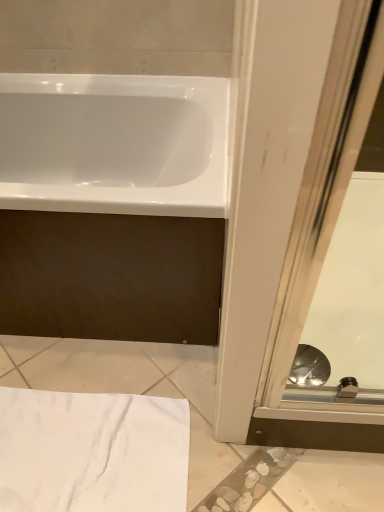
I want to click on white cotton towel at lower left, so click(92, 452).

The image size is (384, 512). Identify the location of white glossy bathtub at upper left. (114, 144).

Identify the location of white cotton towel at lower left. (92, 452).

Which is behind, point (129, 196) or point (76, 480)?

The point (76, 480) is farther from the camera.

Does white glossy bathtub at upper left have a greater height compared to white cotton towel at lower left?

Indeed, white glossy bathtub at upper left has a greater height compared to white cotton towel at lower left.

Between white glossy bathtub at upper left and white cotton towel at lower left, which one appears on the right side from the viewer's perspective?

From the viewer's perspective, white cotton towel at lower left appears more on the right side.

Is white glossy bathtub at upper left turned away from white cotton towel at lower left?

white glossy bathtub at upper left is not turned away from white cotton towel at lower left.

How different are the orientations of white cotton towel at lower left and transparent glass screen door at lower right in degrees?

The angular difference between white cotton towel at lower left and transparent glass screen door at lower right is 0.00106 degrees.

Based on the photo, is white cotton towel at lower left not near transparent glass screen door at lower right?

white cotton towel at lower left is near transparent glass screen door at lower right, not far away.

From the image's perspective, would you say white cotton towel at lower left is positioned over transparent glass screen door at lower right?

Incorrect, from the image's perspective, white cotton towel at lower left is lower than transparent glass screen door at lower right.

Which of these two, transparent glass screen door at lower right or white cotton towel at lower left, is thinner?

white cotton towel at lower left.

Find the location of `bath towel that is under the transparent glass screen door at lower right (from a real-world perspective)`. bath towel that is under the transparent glass screen door at lower right (from a real-world perspective) is located at coordinates (92, 452).

Is transparent glass screen door at lower right facing towards white cotton towel at lower left?

No, transparent glass screen door at lower right is not facing towards white cotton towel at lower left.

Is transparent glass screen door at lower right closer to camera compared to white cotton towel at lower left?

Yes, transparent glass screen door at lower right is closer to the camera.

Does white glossy bathtub at upper left appear on the right side of transparent glass screen door at lower right?

Incorrect, white glossy bathtub at upper left is not on the right side of transparent glass screen door at lower right.

Is point (86, 142) closer or farther from the camera than point (327, 387)?

Point (86, 142) is farther from the camera than point (327, 387).

From the image's perspective, is white glossy bathtub at upper left located beneath transparent glass screen door at lower right?

Actually, white glossy bathtub at upper left appears above transparent glass screen door at lower right in the image.

Is white glossy bathtub at upper left directly adjacent to transparent glass screen door at lower right?

No, white glossy bathtub at upper left is not beside transparent glass screen door at lower right.

From a real-world perspective, which object stands above the other?

white glossy bathtub at upper left is physically above.

Does transparent glass screen door at lower right appear on the right side of white glossy bathtub at upper left?

Correct, you'll find transparent glass screen door at lower right to the right of white glossy bathtub at upper left.

Relative to white glossy bathtub at upper left, is transparent glass screen door at lower right in front or behind?

Clearly, transparent glass screen door at lower right is behind white glossy bathtub at upper left.

Can you tell me how much transparent glass screen door at lower right and white glossy bathtub at upper left differ in facing direction?

There is a 0.000206-degree angle between the facing directions of transparent glass screen door at lower right and white glossy bathtub at upper left.

In the scene shown: Is white cotton towel at lower left to the right of white glossy bathtub at upper left from the viewer's perspective?

Yes, white cotton towel at lower left is to the right of white glossy bathtub at upper left.

Which object is thinner, white cotton towel at lower left or white glossy bathtub at upper left?

white cotton towel at lower left.

From a real-world perspective, which object stands above the other?

From a 3D spatial view, white glossy bathtub at upper left is above.

Between white cotton towel at lower left and white glossy bathtub at upper left, which one has more height?

white glossy bathtub at upper left is taller.

At what (x,y) coordinates should I click in order to perform the action: click on bathtub in front of the white cotton towel at lower left. Please return your answer as a coordinate pair (x, y). Looking at the image, I should click on (114, 144).

Identify the location of bath towel behind the transparent glass screen door at lower right. (92, 452).

Considering their positions, is white glossy bathtub at upper left positioned closer to white cotton towel at lower left than transparent glass screen door at lower right?

Among the two, transparent glass screen door at lower right is located nearer to white cotton towel at lower left.

Estimate the real-world distances between objects in this image. Which object is closer to white glossy bathtub at upper left, white cotton towel at lower left or transparent glass screen door at lower right?

Among the two, transparent glass screen door at lower right is located nearer to white glossy bathtub at upper left.

From the image, which object appears to be nearer to white cotton towel at lower left, transparent glass screen door at lower right or white glossy bathtub at upper left?

transparent glass screen door at lower right lies closer to white cotton towel at lower left than the other object.

Estimate the real-world distances between objects in this image. Which object is closer to transparent glass screen door at lower right, white cotton towel at lower left or white glossy bathtub at upper left?

white cotton towel at lower left is positioned closer to the anchor transparent glass screen door at lower right.

When comparing their distances from white glossy bathtub at upper left, does transparent glass screen door at lower right or white cotton towel at lower left seem further?

white cotton towel at lower left is further to white glossy bathtub at upper left.

Which object lies nearer to the anchor point transparent glass screen door at lower right, white glossy bathtub at upper left or white cotton towel at lower left?

Among the two, white cotton towel at lower left is located nearer to transparent glass screen door at lower right.

This screenshot has height=512, width=384. Find the location of `bath towel located between white glossy bathtub at upper left and transparent glass screen door at lower right in the left-right direction`. bath towel located between white glossy bathtub at upper left and transparent glass screen door at lower right in the left-right direction is located at coordinates (92, 452).